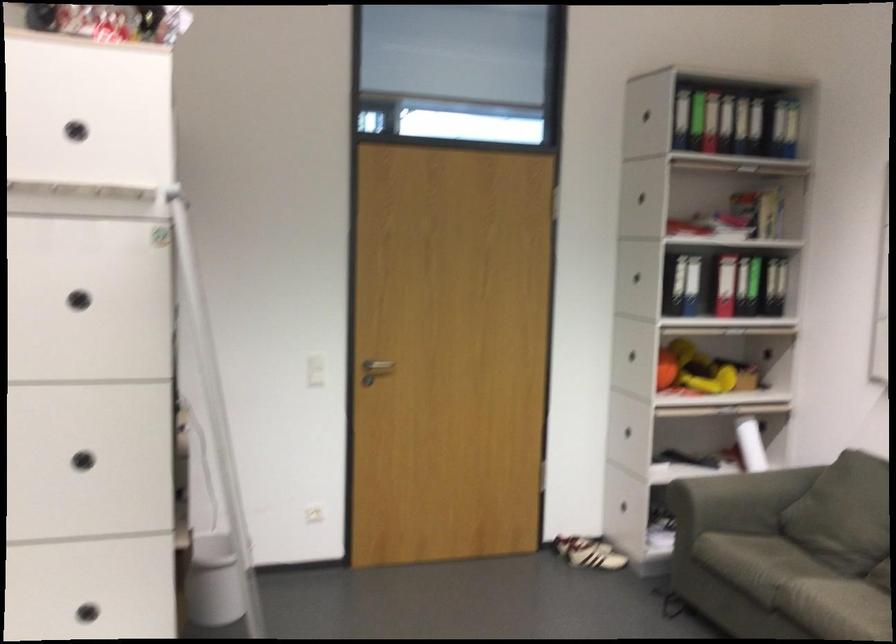
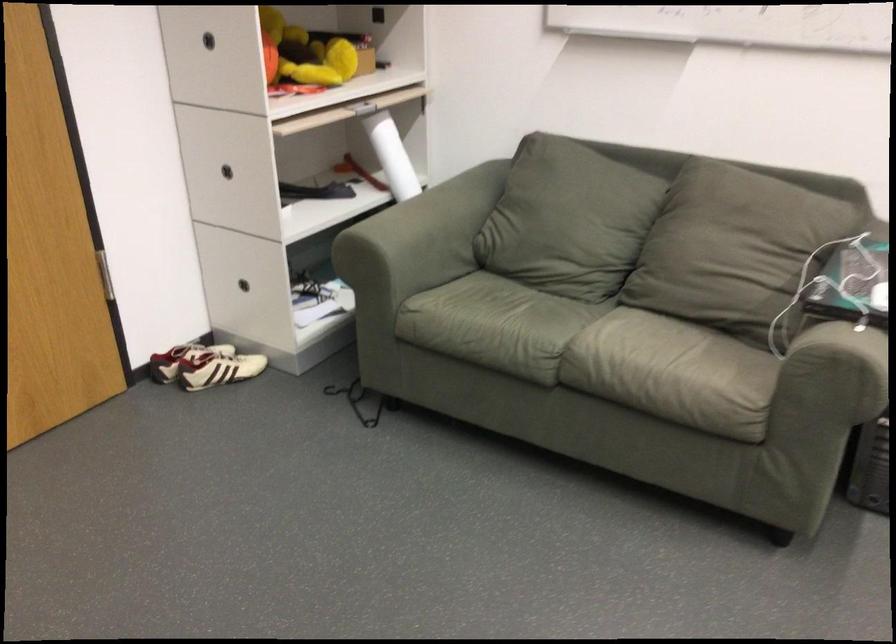
Locate, in the second image, the point that corresponds to point (745, 565) in the first image.

(495, 325)